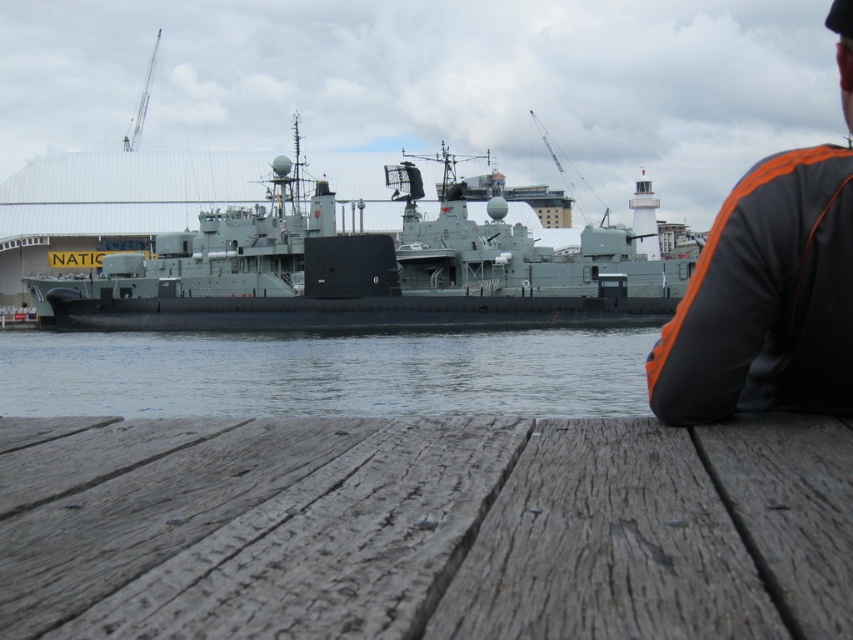
You are a dock worker who needs to place a new orange fabric jacket at upper right on the wooden deck. The clear water at center is currently occupying the space. Can the jacket be placed there without overlapping the water area?

The clear water at center is wider than the orange fabric jacket at upper right. Since the water area is wider, there might be enough space to place the jacket without overlapping, but you should check the exact dimensions to ensure compatibility.

You are a photographer standing at the naval dockyard. You want to take a photo of the two points marked in the scene. Which point, point (605,609) or point (212,371), will appear larger in your photo?

Point (605,609) is closer to the camera than point (212,371), so it will appear larger in the photo.